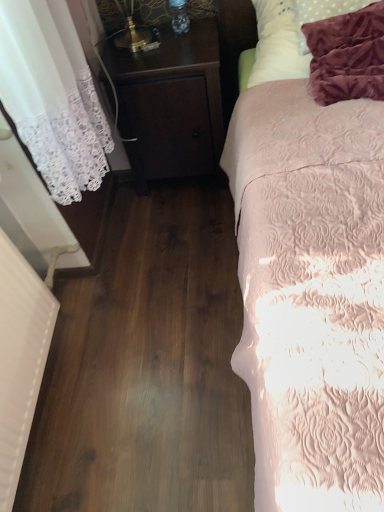
Question: From a real-world perspective, is dark wood nightstand at center below white soft pillow at upper right?

Choices:
 (A) yes
 (B) no

Answer: (A)

Question: Does dark wood nightstand at center appear on the right side of white soft pillow at upper right?

Choices:
 (A) no
 (B) yes

Answer: (A)

Question: Does dark wood nightstand at center touch white soft pillow at upper right?

Choices:
 (A) no
 (B) yes

Answer: (A)

Question: Is white soft pillow at upper right located within dark wood nightstand at center?

Choices:
 (A) yes
 (B) no

Answer: (B)

Question: Would you say dark wood nightstand at center is a long distance from white soft pillow at upper right?

Choices:
 (A) yes
 (B) no

Answer: (B)

Question: Is dark wood nightstand at center wider or thinner than pink quilted bed at right?

Choices:
 (A) wide
 (B) thin

Answer: (B)

Question: Considering their positions, is dark wood nightstand at center located in front of or behind pink quilted bed at right?

Choices:
 (A) behind
 (B) front

Answer: (A)

Question: From a real-world perspective, is dark wood nightstand at center above or below pink quilted bed at right?

Choices:
 (A) below
 (B) above

Answer: (A)

Question: Is dark wood nightstand at center inside the boundaries of pink quilted bed at right, or outside?

Choices:
 (A) outside
 (B) inside

Answer: (A)

Question: Based on their positions, is dark wood nightstand at center located to the left or right of white soft pillow at upper right?

Choices:
 (A) right
 (B) left

Answer: (B)

Question: Which is correct: dark wood nightstand at center is inside white soft pillow at upper right, or outside of it?

Choices:
 (A) outside
 (B) inside

Answer: (A)

Question: From a real-world perspective, is dark wood nightstand at center physically located above or below white soft pillow at upper right?

Choices:
 (A) below
 (B) above

Answer: (A)

Question: Looking at the image, does dark wood nightstand at center seem bigger or smaller compared to white soft pillow at upper right?

Choices:
 (A) small
 (B) big

Answer: (B)

Question: In terms of height, does white soft pillow at upper right look taller or shorter compared to pink quilted bed at right?

Choices:
 (A) tall
 (B) short

Answer: (B)

Question: Considering their positions, is white soft pillow at upper right located in front of or behind pink quilted bed at right?

Choices:
 (A) front
 (B) behind

Answer: (B)